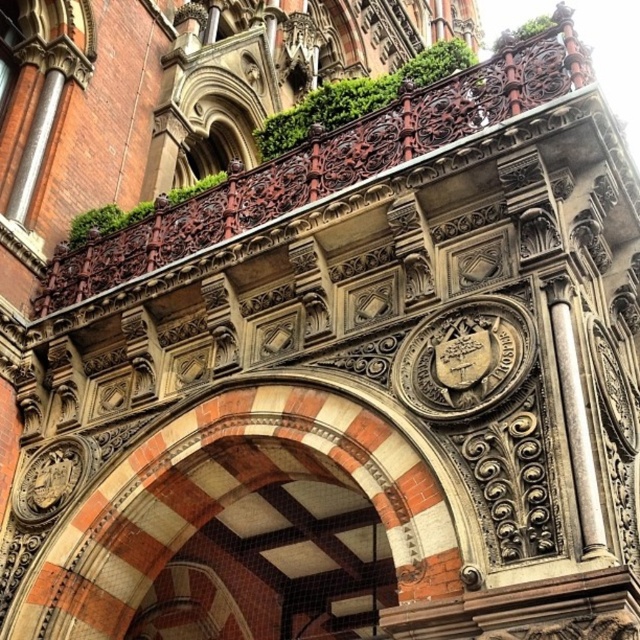
You are an architect assessing the structural integrity of the green leafy ivy at upper center and the white marble column at center. Which object occupies more space in the image?

The green leafy ivy at upper center has a larger size compared to the white marble column at center, so it occupies more space in the image.

In the scene shown: You are an architect analyzing the structure of the archway. You notice two points marked on the image. The first point is located at coordinates point (276, 477) and the second at point (593, 538). Which point is closer to the viewer?

Point (593, 538) is closer to the viewer because the description states that point (276, 477) is behind point (593, 538).

You are an architect inspecting the structure. You notice the red brick arch at center and the white marble column at center. Which object is located below the other?

The red brick arch at center is positioned under the white marble column at center, so the red brick arch at center is below the white marble column at center.